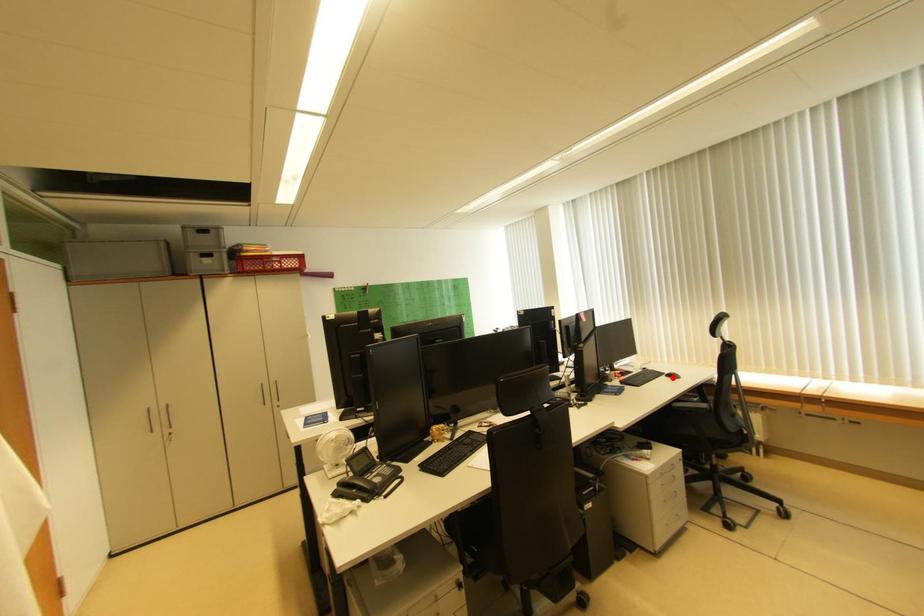
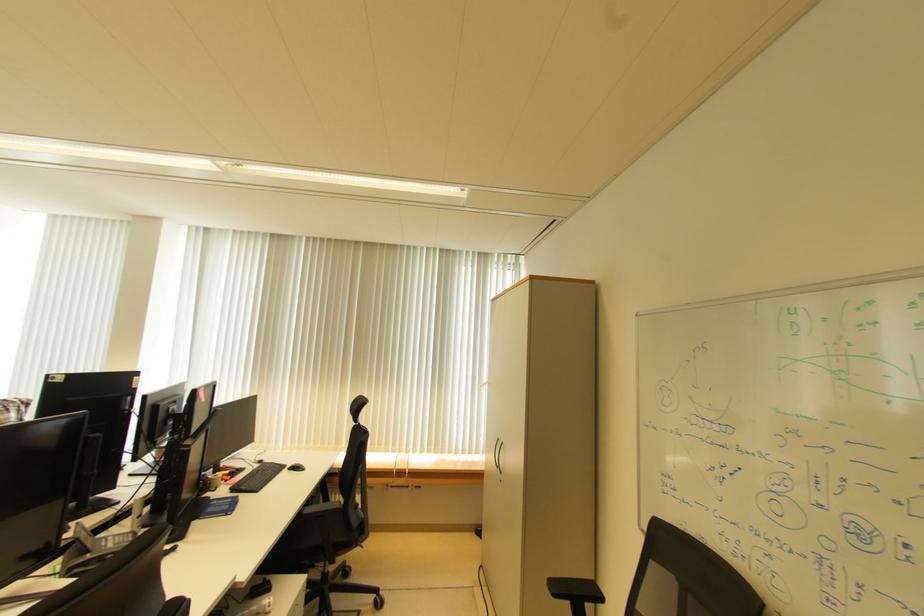
Question: I am providing you with two images of the same scene from different viewpoints. A red point is marked on the first image. Can you still see the location of the red point in image 2?

Choices:
 (A) Yes
 (B) No

Answer: (A)